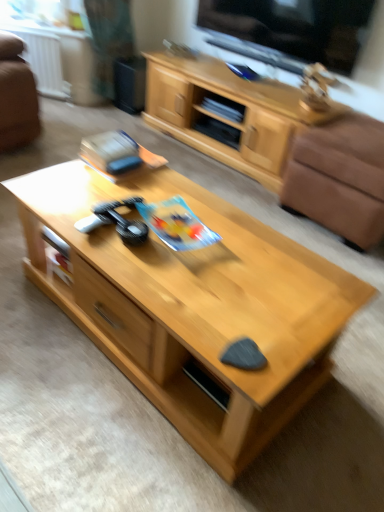
You are a GUI agent. You are given a task and a screenshot of the screen. Output one action in this format:
    pyautogui.click(x=<x>, y=<y>)
    Task: Click on the free point in front of light wood coffee table at center
    Image resolution: width=384 pixels, height=512 pixels.
    Given the screenshot: What is the action you would take?
    pyautogui.click(x=134, y=442)